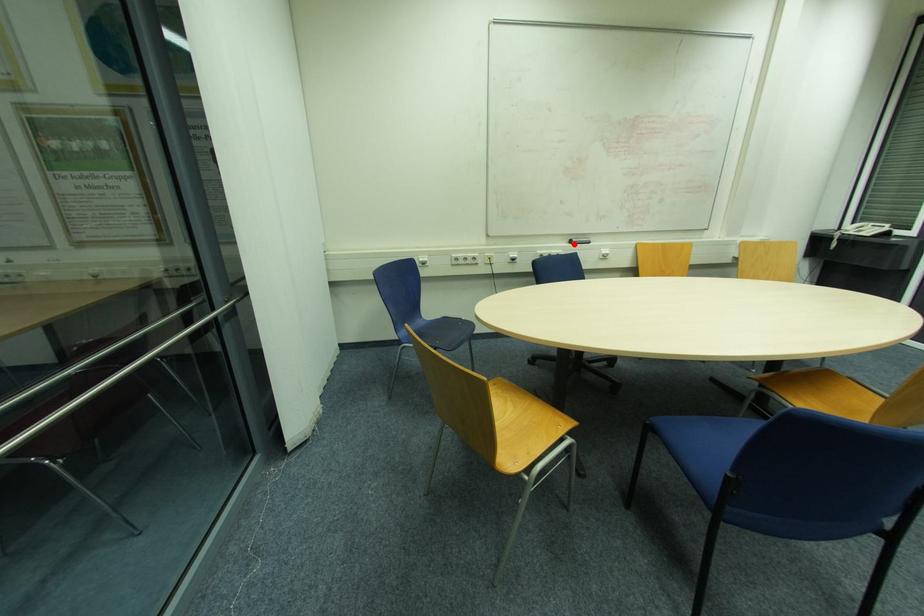
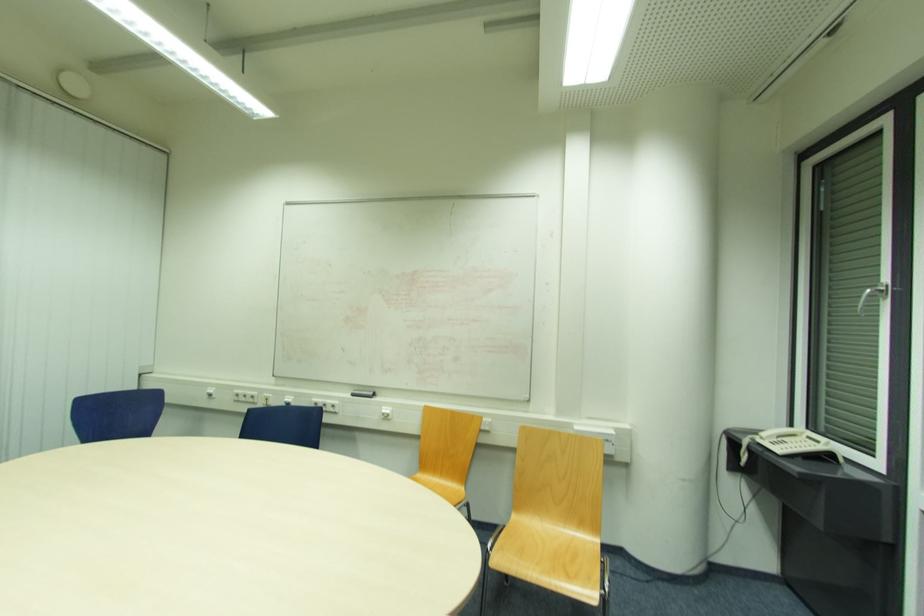
Question: I am providing you with two images of the same scene from different viewpoints. In image1, a red point is highlighted. Considering the same 3D point in image2, which of the following is correct?

Choices:
 (A) It is closer
 (B) It is farther

Answer: (B)